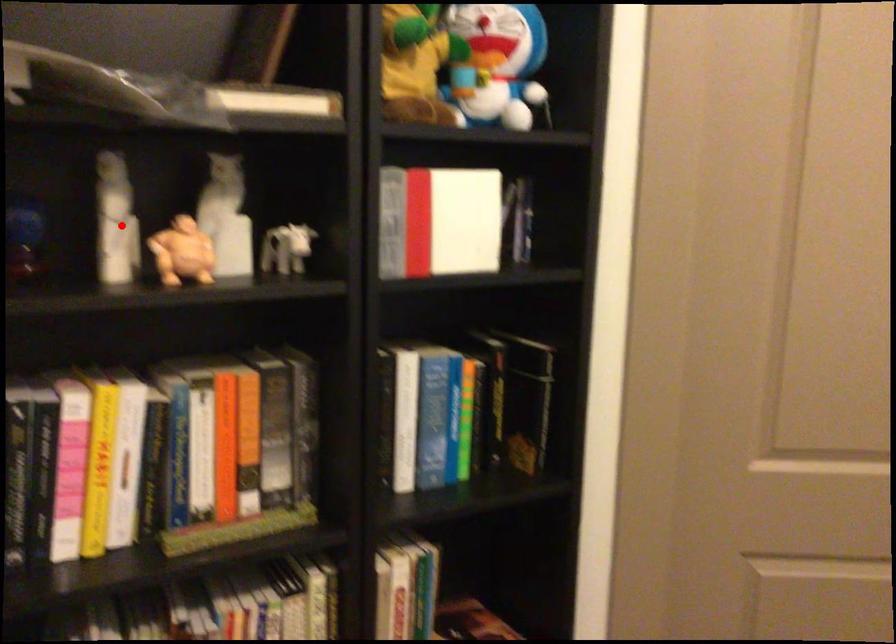
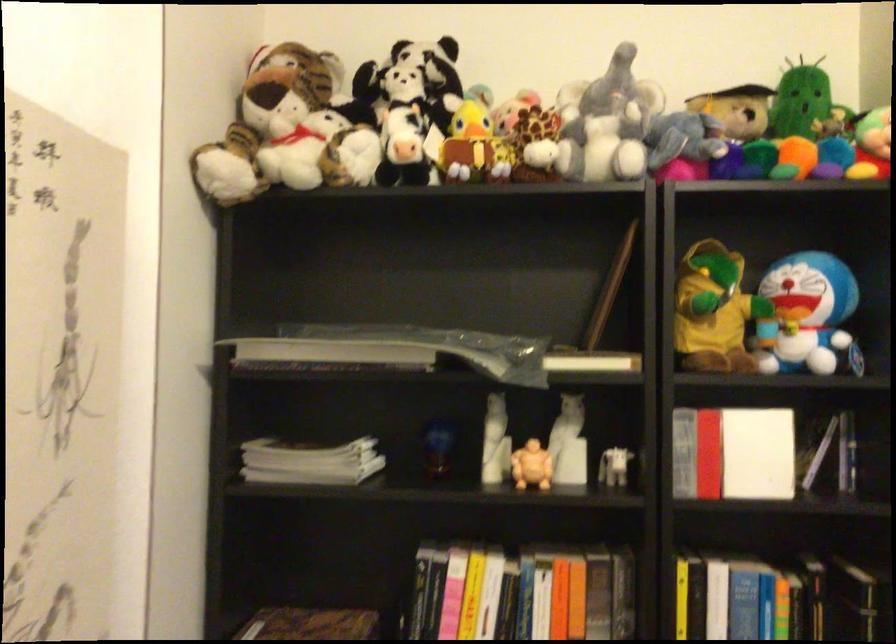
Where in the second image is the point corresponding to the highlighted location from the first image?

(495, 442)